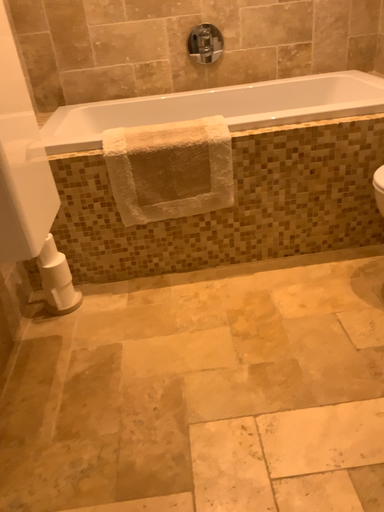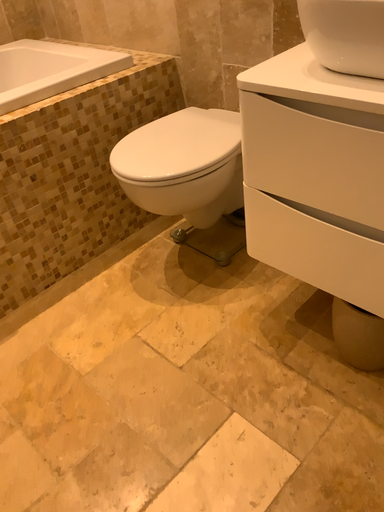
Question: Which way did the camera rotate in the video?

Choices:
 (A) rotated right
 (B) rotated left

Answer: (A)